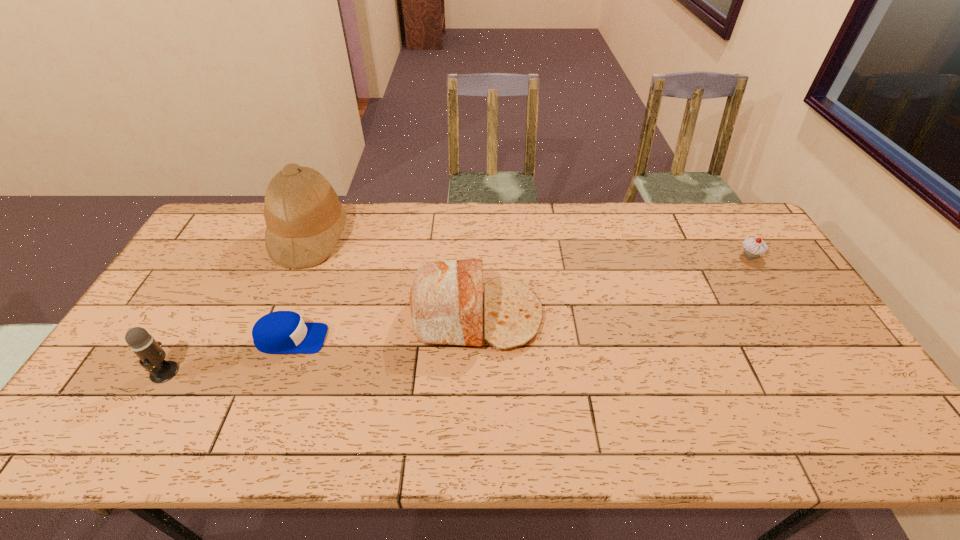
Where is `vacant space that satisfies the following two spatial constraints: 1. on the front-facing side of the baseball cap; 2. on the front side of the nearest object`? vacant space that satisfies the following two spatial constraints: 1. on the front-facing side of the baseball cap; 2. on the front side of the nearest object is located at coordinates (278, 372).

This screenshot has height=540, width=960. Identify the location of vacant area in the image that satisfies the following two spatial constraints: 1. on the front-facing side of the rightmost object; 2. on the right side of the hat. (302, 255).

You are a GUI agent. You are given a task and a screenshot of the screen. Output one action in this format:
    pyautogui.click(x=<x>, y=<y>)
    Task: Click on the free point that satisfies the following two spatial constraints: 1. on the front-facing side of the shortest object; 2. on the front side of the microphone
    This screenshot has height=540, width=960.
    Given the screenshot: What is the action you would take?
    pyautogui.click(x=278, y=372)

The width and height of the screenshot is (960, 540). In order to click on free space that satisfies the following two spatial constraints: 1. on the front-facing side of the hat; 2. on the back side of the rightmost object in this screenshot , I will do `click(302, 255)`.